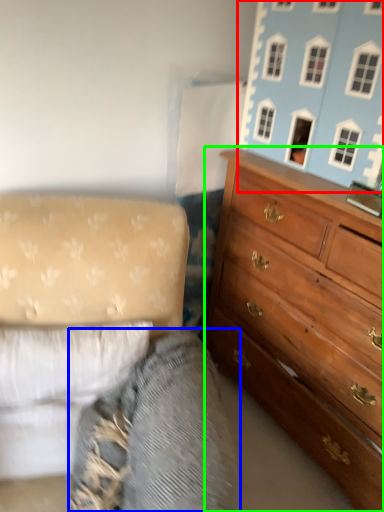
Question: Which is farther away from toy (highlighted by a red box)? gray (highlighted by a blue box) or chest of drawers (highlighted by a green box)?

Choices:
 (A) gray
 (B) chest of drawers

Answer: (A)